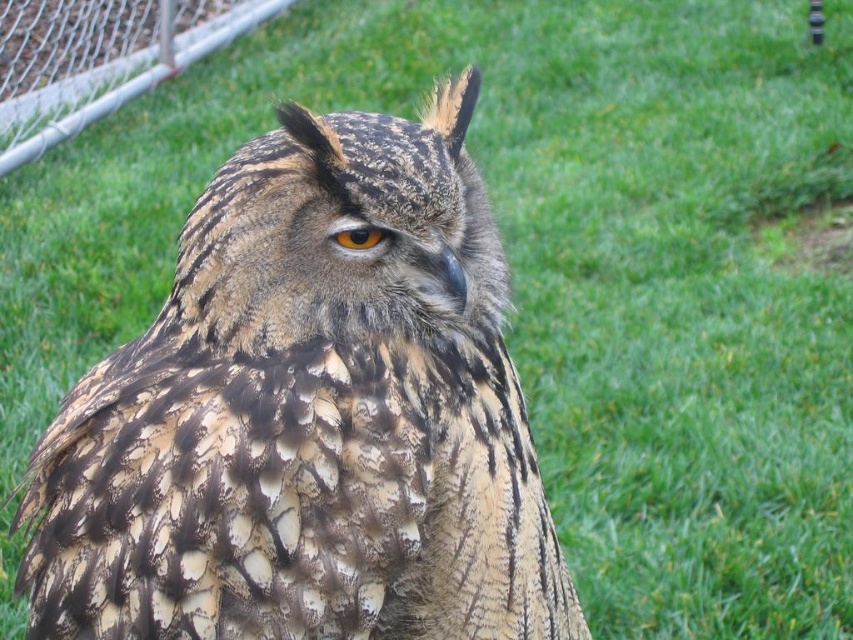
Does camouflage feathered owl at center have a lesser height compared to brushed metal fence at upper left?

Correct, camouflage feathered owl at center is not as tall as brushed metal fence at upper left.

Does camouflage feathered owl at center have a smaller size compared to brushed metal fence at upper left?

Yes.

Find the location of a particular element. camouflage feathered owl at center is located at coordinates (308, 416).

Between point (292, 515) and point (344, 232), which one is positioned in front?

Point (292, 515) is in front.

Which of these two, camouflage feathered owl at center or brown textured eye at center, stands shorter?

With less height is brown textured eye at center.

Is point (397, 636) closer to camera compared to point (361, 232)?

Yes, point (397, 636) is closer to viewer.

Identify the location of camouflage feathered owl at center. This screenshot has width=853, height=640. (308, 416).

Looking at this image, does brushed metal fence at upper left lie in front of brown textured eye at center?

No, brushed metal fence at upper left is behind brown textured eye at center.

Find the location of a particular element. This screenshot has width=853, height=640. brushed metal fence at upper left is located at coordinates (99, 60).

You are a GUI agent. You are given a task and a screenshot of the screen. Output one action in this format:
    pyautogui.click(x=<x>, y=<y>)
    Task: Click on the brushed metal fence at upper left
    
    Given the screenshot: What is the action you would take?
    pyautogui.click(x=99, y=60)